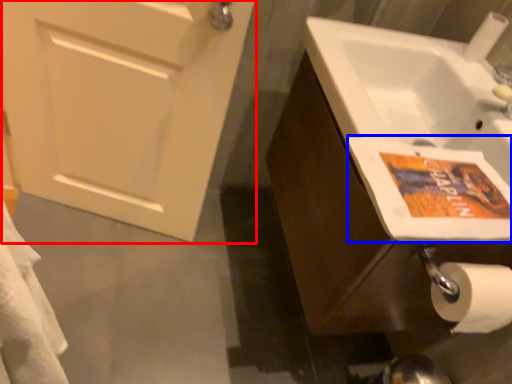
Question: Which object appears farthest to the camera in this image, door (highlighted by a red box) or flyer (highlighted by a blue box)?

Choices:
 (A) door
 (B) flyer

Answer: (A)